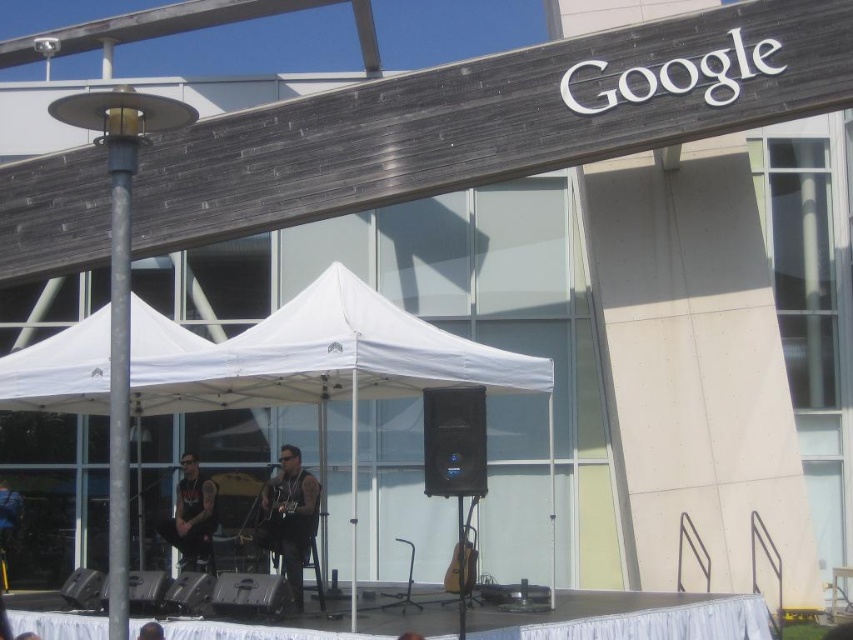
What do you see at coordinates (318, 360) in the screenshot? I see `white fabric tent at center` at bounding box center [318, 360].

Which is in front, point (0, 392) or point (312, 506)?

Point (0, 392) is more forward.

The width and height of the screenshot is (853, 640). What are the coordinates of `white fabric tent at center` in the screenshot? It's located at (318, 360).

Can you confirm if white fabric tent at center is bigger than black leather jacket at center?

Indeed, white fabric tent at center has a larger size compared to black leather jacket at center.

Can you confirm if white fabric tent at center is shorter than black leather jacket at center?

No.

Identify the location of white fabric tent at center. The image size is (853, 640). (318, 360).

Who is more distant from viewer, (289, 477) or (177, 548)?

The point (177, 548) is more distant.

Is black leather vest at center taller than black leather jacket at center?

Yes, black leather vest at center is taller than black leather jacket at center.

Where is `black leather vest at center`? The width and height of the screenshot is (853, 640). black leather vest at center is located at coordinates (289, 516).